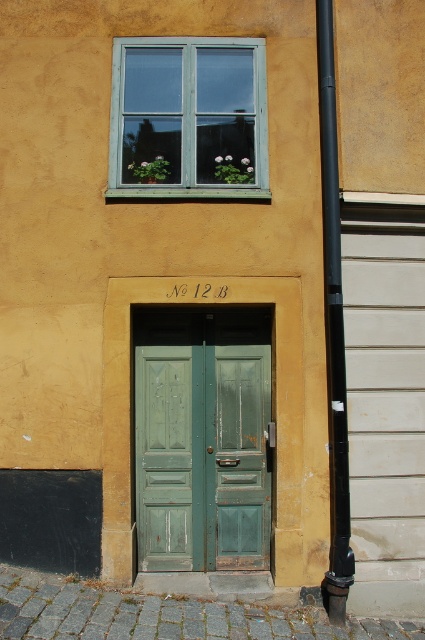
Question: Can you confirm if green matte door at center is positioned below black matte pipe at right?

Choices:
 (A) yes
 (B) no

Answer: (A)

Question: Among these points, which one is nearest to the camera?

Choices:
 (A) (144, 49)
 (B) (235, 529)

Answer: (B)

Question: Which point is farther to the camera?

Choices:
 (A) teal wooden window at upper center
 (B) green matte door at center

Answer: (B)

Question: Does green matte door at center appear on the right side of teal wooden window at upper center?

Choices:
 (A) no
 (B) yes

Answer: (B)

Question: Among these points, which one is nearest to the camera?

Choices:
 (A) (209, 429)
 (B) (133, 168)
 (C) (329, 140)

Answer: (C)

Question: Can you confirm if teal wooden window at upper center is thinner than black matte pipe at right?

Choices:
 (A) no
 (B) yes

Answer: (A)